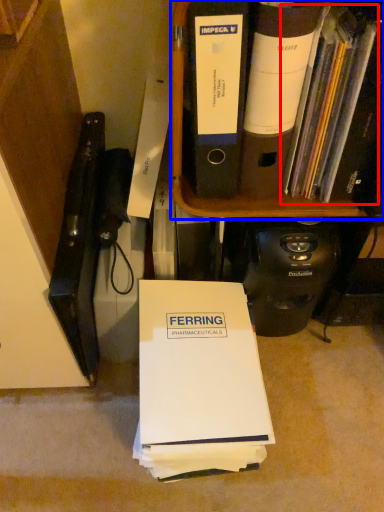
Question: Which object is further to the camera taking this photo, book (highlighted by a red box) or bookcase (highlighted by a blue box)?

Choices:
 (A) book
 (B) bookcase

Answer: (B)